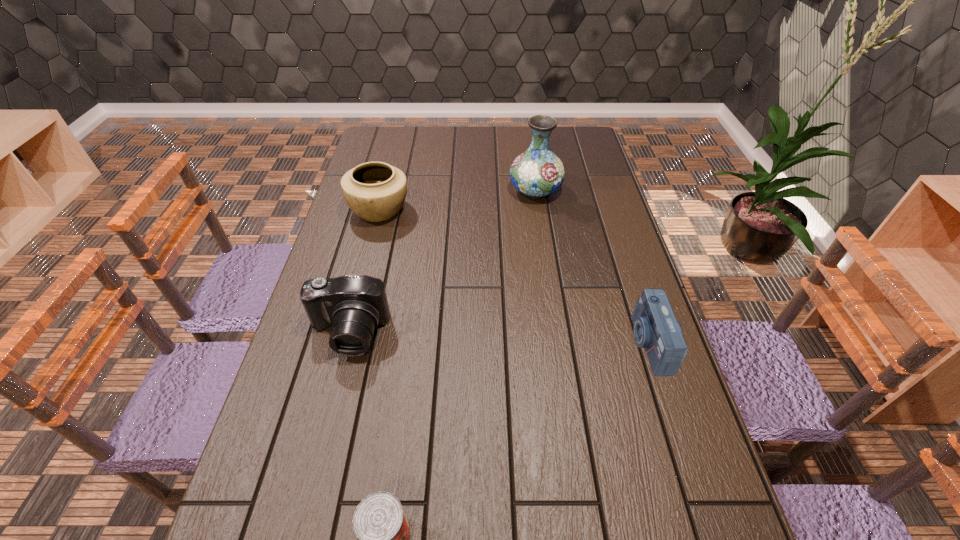
Locate an element on the screen. The height and width of the screenshot is (540, 960). the tallest object is located at coordinates (536, 173).

The width and height of the screenshot is (960, 540). Identify the location of vase. (536, 173).

The width and height of the screenshot is (960, 540). I want to click on pottery, so click(375, 191).

Identify the location of the taller camera. (354, 305).

In order to click on the shorter camera in this screenshot , I will do `click(656, 329)`.

In order to click on the right camera in this screenshot , I will do `click(656, 329)`.

The width and height of the screenshot is (960, 540). Identify the location of vacant space located on the right of the tallest object. (590, 191).

You are a GUI agent. You are given a task and a screenshot of the screen. Output one action in this format:
    pyautogui.click(x=<x>, y=<y>)
    Task: Click on the free space located 0.210m on the back of the pottery
    The height and width of the screenshot is (540, 960).
    Given the screenshot: What is the action you would take?
    pyautogui.click(x=393, y=160)

Locate an element on the screen. free location located 0.220m on the lens of the taller camera is located at coordinates (319, 449).

Where is `vacant point located 0.100m on the lens of the shorter camera`? vacant point located 0.100m on the lens of the shorter camera is located at coordinates (594, 343).